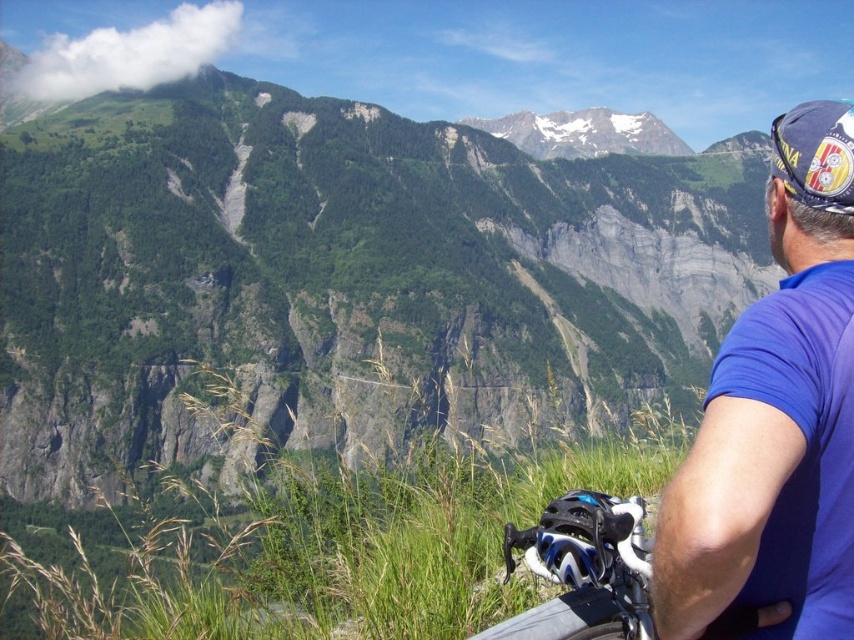
Question: Which point is farther to the camera?

Choices:
 (A) (781, 253)
 (B) (566, 115)

Answer: (B)

Question: Considering the relative positions of green rock at center and blue fabric shirt at right in the image provided, where is green rock at center located with respect to blue fabric shirt at right?

Choices:
 (A) right
 (B) left

Answer: (B)

Question: Which point is farther to the camera?

Choices:
 (A) blue fabric shirt at right
 (B) white snow-covered mountain at upper center

Answer: (B)

Question: Among these points, which one is farthest from the camera?

Choices:
 (A) pos(623,125)
 (B) pos(471,214)
 (C) pos(659,545)

Answer: (A)

Question: Can you confirm if green rock at center is bigger than white snow-covered mountain at upper center?

Choices:
 (A) yes
 (B) no

Answer: (A)

Question: Is blue fabric shirt at right wider than white snow-covered mountain at upper center?

Choices:
 (A) yes
 (B) no

Answer: (B)